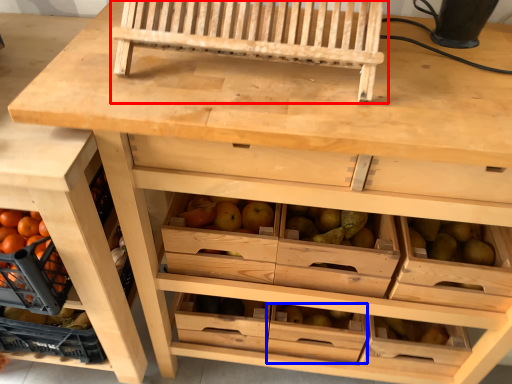
Question: Which of the following is the farthest to the observer, church bench (highlighted by a red box) or drawer (highlighted by a blue box)?

Choices:
 (A) church bench
 (B) drawer

Answer: (B)